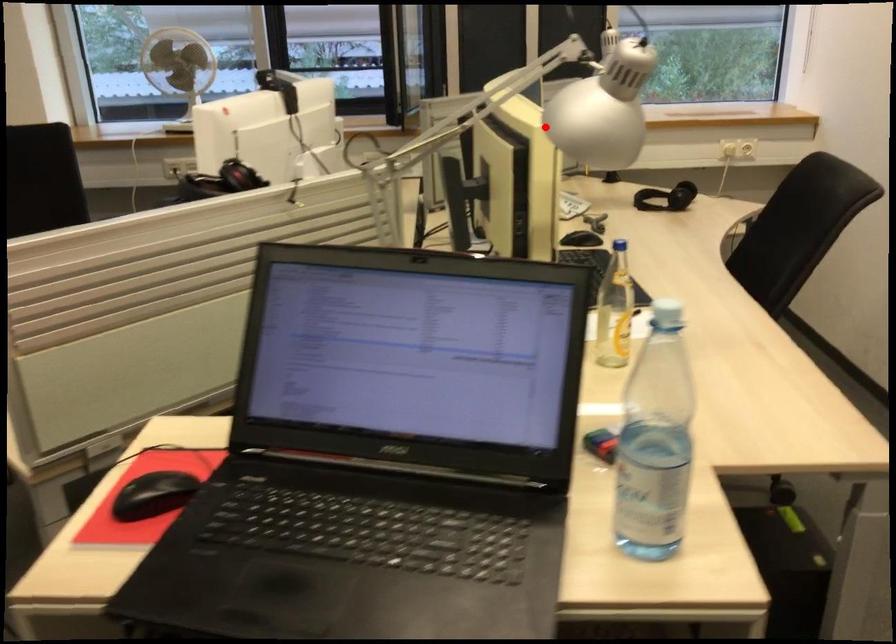
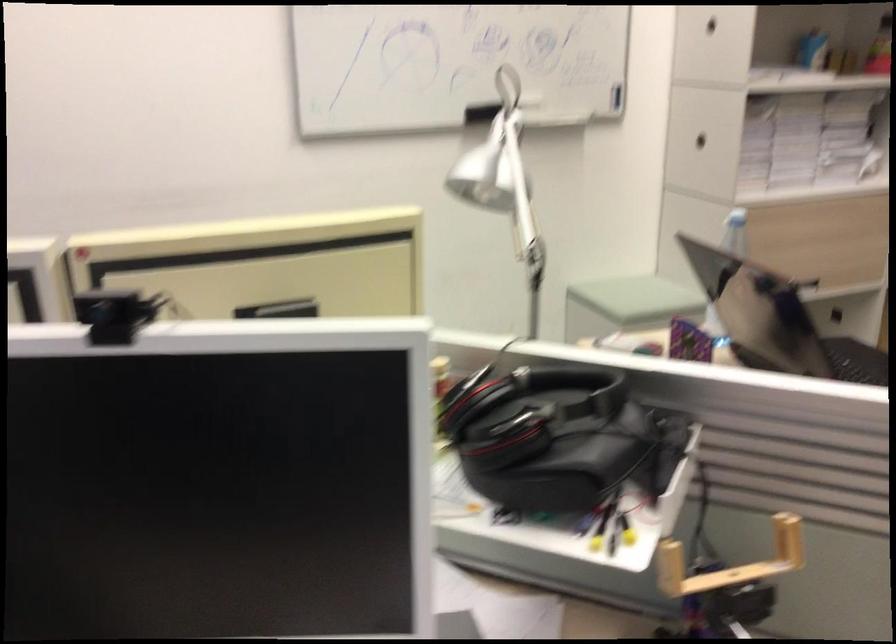
Question: I am providing you with two images of the same scene from different viewpoints. Image1 has a red point marked. In image2, the corresponding 3D location appears at what relative position? Reply with the corresponding letter.

Choices:
 (A) Closer
 (B) Farther

Answer: (B)